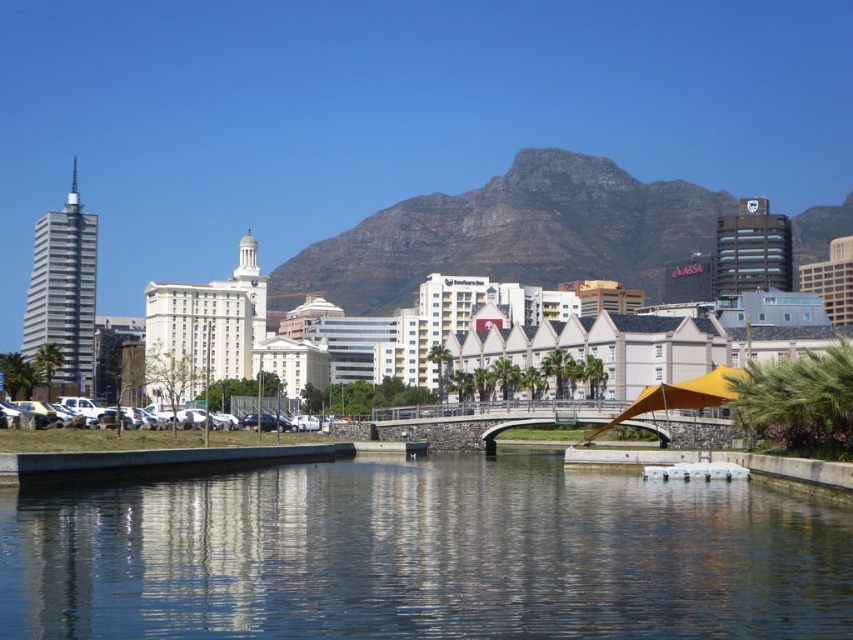
Question: Which is nearer to the yellow fabric umbrella at center?

Choices:
 (A) transparent glass water at center
 (B) rugged stone mountain at center

Answer: (A)

Question: Observing the image, what is the correct spatial positioning of transparent glass water at center in reference to yellow fabric umbrella at center?

Choices:
 (A) below
 (B) above

Answer: (A)

Question: Considering the real-world distances, which object is closest to the transparent glass water at center?

Choices:
 (A) rugged stone mountain at center
 (B) yellow fabric umbrella at center

Answer: (B)

Question: Among these points, which one is nearest to the camera?

Choices:
 (A) (717, 387)
 (B) (755, 540)
 (C) (611, 262)

Answer: (B)

Question: Does rugged stone mountain at center appear over yellow fabric umbrella at center?

Choices:
 (A) yes
 (B) no

Answer: (A)

Question: Is transparent glass water at center thinner than rugged stone mountain at center?

Choices:
 (A) no
 (B) yes

Answer: (B)